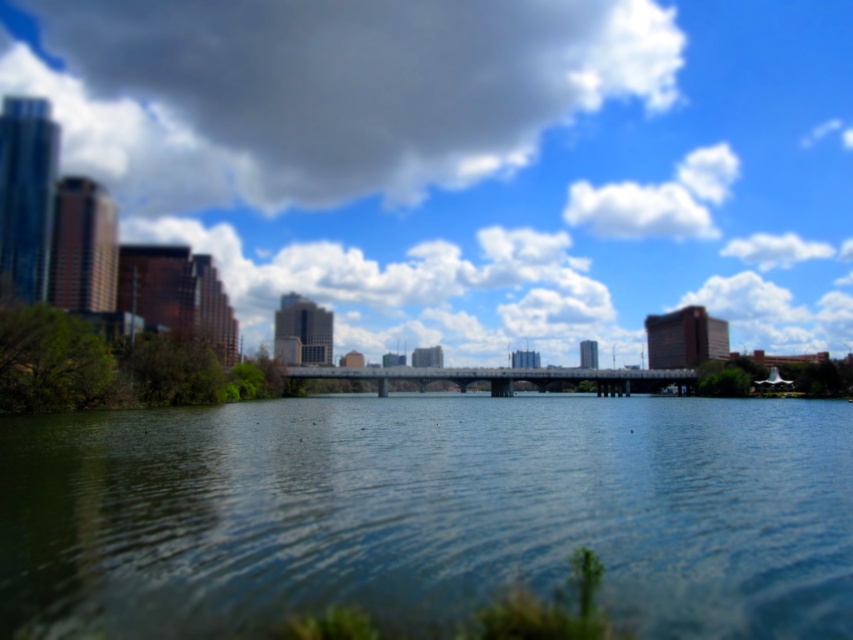
Which of these two, blue water at center or white fluffy cloud at upper center, stands shorter?

Standing shorter between the two is blue water at center.

Between point (80, 433) and point (628, 186), which one is positioned in front?

Point (80, 433) is more forward.

You are a GUI agent. You are given a task and a screenshot of the screen. Output one action in this format:
    pyautogui.click(x=<x>, y=<y>)
    Task: Click on the blue water at center
    This screenshot has height=640, width=853.
    Given the screenshot: What is the action you would take?
    pyautogui.click(x=427, y=513)

Where is `blue sky at upper center`? The height and width of the screenshot is (640, 853). blue sky at upper center is located at coordinates (473, 160).

Is point (827, 29) positioned behind point (625, 214)?

Yes.

Which is in front, point (726, 90) or point (709, 195)?

Point (709, 195) is more forward.

What are the coordinates of `blue sky at upper center` in the screenshot? It's located at (473, 160).

Which is above, dark gray cloud at upper center or white fluffy cloud at upper center?

dark gray cloud at upper center is above.

Describe the element at coordinates (322, 90) in the screenshot. This screenshot has height=640, width=853. I see `dark gray cloud at upper center` at that location.

Is point (70, 141) in front of point (662, 228)?

Yes.

The width and height of the screenshot is (853, 640). In order to click on dark gray cloud at upper center in this screenshot , I will do `click(322, 90)`.